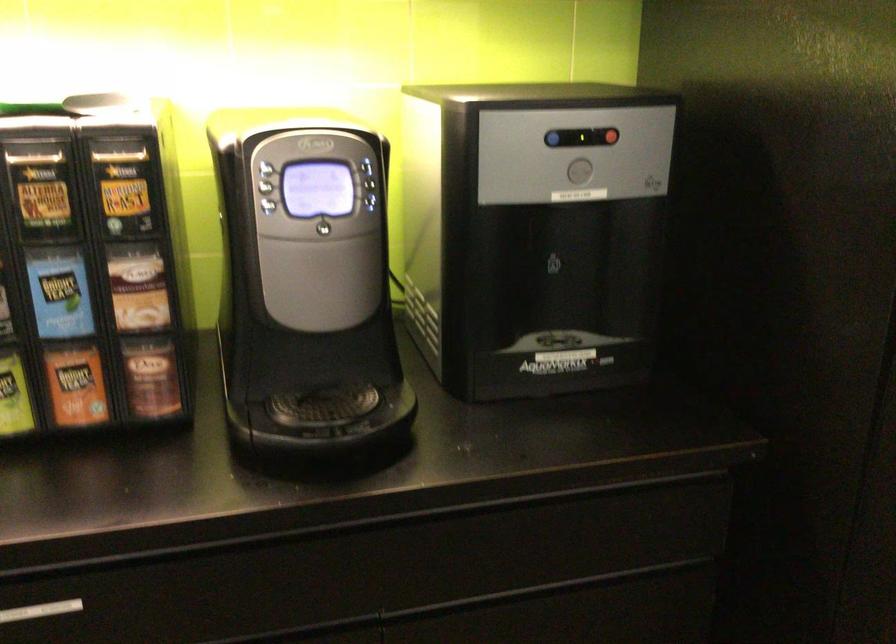
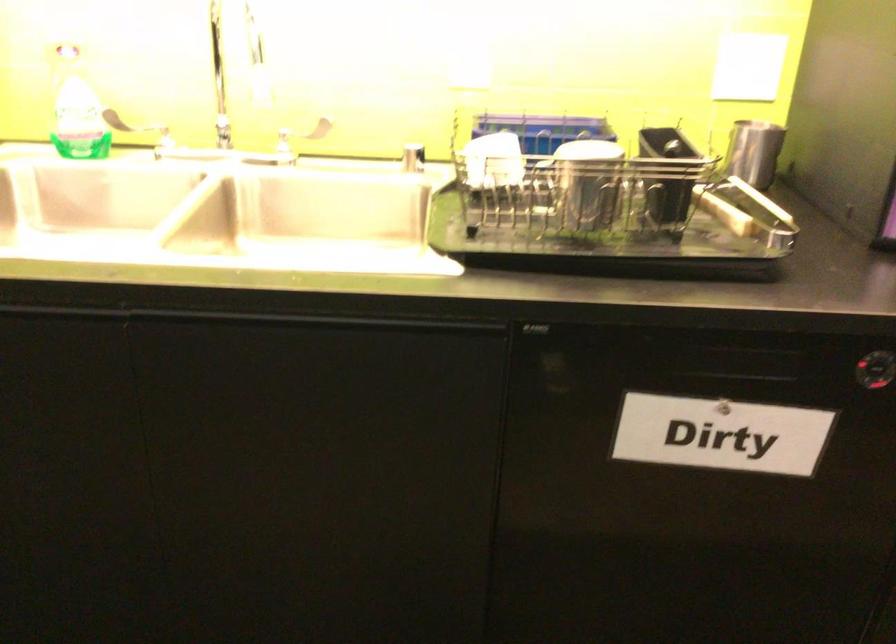
Question: The images are taken continuously from a first-person perspective. In which direction are you moving?

Choices:
 (A) Left
 (B) Right
 (C) Forward
 (D) Backward

Answer: (A)